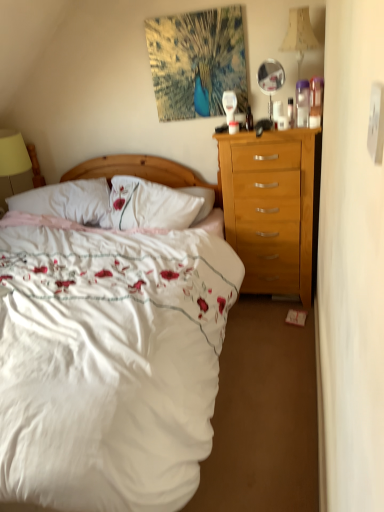
Describe the element at coordinates (112, 372) in the screenshot. I see `white satin bed at center` at that location.

Image resolution: width=384 pixels, height=512 pixels. What do you see at coordinates (233, 127) in the screenshot? I see `matte white coffee cup at center` at bounding box center [233, 127].

In order to face clear plastic bottle at upper right, marked as the first bottle in a right-to-left arrangement, should I rotate leftwards or rightwards?

Rotate your view right by about 13.258°.

Describe the element at coordinates (143, 170) in the screenshot. I see `wooden headboard at center` at that location.

Where is `white soft pillow at center`? Image resolution: width=384 pixels, height=512 pixels. white soft pillow at center is located at coordinates (68, 201).

Is beige fabric lampshade at upper right, which is counted as the second lamp, starting from the left, outside of yellow fabric lampshade at left, which is counted as the 1th lamp, starting from the back?

Yes, beige fabric lampshade at upper right, which is counted as the second lamp, starting from the left, is located beyond the bounds of yellow fabric lampshade at left, which is counted as the 1th lamp, starting from the back.

Consider the image. Does beige fabric lampshade at upper right, acting as the second lamp starting from the bottom, turn towards yellow fabric lampshade at left, which is the second lamp from right to left?

No, beige fabric lampshade at upper right, acting as the second lamp starting from the bottom, does not turn towards yellow fabric lampshade at left, which is the second lamp from right to left.

Would you say beige fabric lampshade at upper right, which ranks as the second lamp in back-to-front order, is to the left or to the right of yellow fabric lampshade at left, marked as the second lamp in a front-to-back arrangement, in the picture?

From the image, it's evident that beige fabric lampshade at upper right, which ranks as the second lamp in back-to-front order, is to the right of yellow fabric lampshade at left, marked as the second lamp in a front-to-back arrangement.

Is beige fabric lampshade at upper right, acting as the first lamp starting from the right, not close to yellow fabric lampshade at left, which is the second lamp from right to left?

Absolutely, beige fabric lampshade at upper right, acting as the first lamp starting from the right, is distant from yellow fabric lampshade at left, which is the second lamp from right to left.

Is beige fabric lampshade at upper right, which is counted as the second lamp, starting from the left, at the back of clear glass mirror at upper right?

That's not correct — clear glass mirror at upper right is not looking away from beige fabric lampshade at upper right, which is counted as the second lamp, starting from the left.

From the image's perspective, is clear glass mirror at upper right located above or below beige fabric lampshade at upper right, which is counted as the second lamp, starting from the left?

Clearly, from the image's perspective, clear glass mirror at upper right is below beige fabric lampshade at upper right, which is counted as the second lamp, starting from the left.

Between clear glass mirror at upper right and beige fabric lampshade at upper right, which is counted as the second lamp, starting from the left, which one is positioned in front?

beige fabric lampshade at upper right, which is counted as the second lamp, starting from the left, is more forward.

Are clear glass mirror at upper right and beige fabric lampshade at upper right, acting as the second lamp starting from the bottom, making contact?

No, clear glass mirror at upper right is not in contact with beige fabric lampshade at upper right, acting as the second lamp starting from the bottom.

Where is `bed that is in front of the clear glass mirror at upper right`? bed that is in front of the clear glass mirror at upper right is located at coordinates (112, 372).

Is clear glass mirror at upper right thinner than white satin bed at center?

Correct, the width of clear glass mirror at upper right is less than that of white satin bed at center.

Between clear glass mirror at upper right and white satin bed at center, which one has larger size?

white satin bed at center.

Is point (73, 205) in front of point (68, 475)?

No, it is not.

Looking at this image, is white soft pillow at center touching white satin bed at center?

No, white soft pillow at center is not with white satin bed at center.

Is white soft pillow at center looking in the opposite direction of translucent plastic bottle at upper center, positioned as the 1th bottle in left-to-right order?

white soft pillow at center does not have its back to translucent plastic bottle at upper center, positioned as the 1th bottle in left-to-right order.

From the picture: From a real-world perspective, is white soft pillow at center over translucent plastic bottle at upper center, which appears as the first bottle when viewed from the top?

Incorrect, from a real-world perspective, white soft pillow at center is lower than translucent plastic bottle at upper center, which appears as the first bottle when viewed from the top.

From the image's perspective, which is below, white soft pillow at center or translucent plastic bottle at upper center, positioned as the 1th bottle in left-to-right order?

white soft pillow at center is shown below in the image.

At what (x,y) coordinates should I click in order to perform the action: click on pillow that appears below the translucent plastic bottle at upper center, arranged as the second bottle when viewed from the right (from the image's perspective). Please return your answer as a coordinate pair (x, y). Image resolution: width=384 pixels, height=512 pixels. Looking at the image, I should click on point(68,201).

Can you confirm if white satin bed at center is thinner than white soft pillow at center?

No.

Who is bigger, white satin bed at center or white soft pillow at center?

white satin bed at center is bigger.

Would you say white satin bed at center is outside white soft pillow at center?

white satin bed at center is positioned outside white soft pillow at center.

Do you think yellow fabric lampshade at left, which is the second lamp from right to left, is within wooden headboard at center, or outside of it?

yellow fabric lampshade at left, which is the second lamp from right to left, is located beyond the bounds of wooden headboard at center.

Could you measure the distance between yellow fabric lampshade at left, which is counted as the 1th lamp, starting from the back, and wooden headboard at center?

A distance of 23.43 inches exists between yellow fabric lampshade at left, which is counted as the 1th lamp, starting from the back, and wooden headboard at center.

Considering the positions of point (18, 143) and point (69, 173), is point (18, 143) closer or farther from the camera than point (69, 173)?

Clearly, point (18, 143) is closer to the camera than point (69, 173).

Does yellow fabric lampshade at left, the 1th lamp in the bottom-to-top sequence, appear on the right side of wooden headboard at center?

No.

The height and width of the screenshot is (512, 384). Identify the location of lamp in front of the yellow fabric lampshade at left, which is the first lamp in left-to-right order. (299, 35).

Identify the location of lamp above the clear glass mirror at upper right (from the image's perspective). Image resolution: width=384 pixels, height=512 pixels. (299, 35).

Considering their positions, is white soft pillow at center positioned further to wooden headboard at center than yellow fabric lampshade at left, placed as the second lamp when sorted from top to bottom?

yellow fabric lampshade at left, placed as the second lamp when sorted from top to bottom, is further to wooden headboard at center.

Considering their positions, is clear plastic bottle at upper right, the first bottle ordered from the bottom, positioned closer to matte white coffee cup at center than yellow fabric lampshade at left, which is counted as the 1th lamp, starting from the back?

clear plastic bottle at upper right, the first bottle ordered from the bottom, lies closer to matte white coffee cup at center than the other object.

Which object lies further to the anchor point white soft pillow at center, yellow fabric lampshade at left, marked as the second lamp in a front-to-back arrangement, or translucent plastic bottle at upper center, positioned as the 1th bottle in left-to-right order?

translucent plastic bottle at upper center, positioned as the 1th bottle in left-to-right order, is positioned further to the anchor white soft pillow at center.

Consider the image. Based on their spatial positions, is clear glass mirror at upper right or matte white coffee cup at center further from clear plastic bottle at upper right, which is the 2th bottle in back-to-front order?

The object further to clear plastic bottle at upper right, which is the 2th bottle in back-to-front order, is matte white coffee cup at center.

Considering their positions, is clear plastic bottle at upper right, the first bottle ordered from the bottom, positioned closer to yellow fabric lampshade at left, which is the first lamp in left-to-right order, than wooden headboard at center?

Based on the image, wooden headboard at center appears to be nearer to yellow fabric lampshade at left, which is the first lamp in left-to-right order.

Based on their spatial positions, is clear plastic bottle at upper right, the second bottle from the left, or clear glass mirror at upper right closer to yellow fabric lampshade at left, marked as the second lamp in a front-to-back arrangement?

clear glass mirror at upper right is positioned closer to the anchor yellow fabric lampshade at left, marked as the second lamp in a front-to-back arrangement.

Estimate the real-world distances between objects in this image. Which object is further from beige fabric lampshade at upper right, acting as the second lamp starting from the bottom, wooden headboard at center or white soft pillow at center?

white soft pillow at center lies further to beige fabric lampshade at upper right, acting as the second lamp starting from the bottom, than the other object.

Based on their spatial positions, is clear plastic bottle at upper right, the second bottle from the left, or clear glass mirror at upper right closer to white soft pillow at center?

clear glass mirror at upper right is closer to white soft pillow at center.

Locate an element on the screen. The height and width of the screenshot is (512, 384). bottle located between matte white coffee cup at center and beige fabric lampshade at upper right, which is counted as the second lamp, starting from the left, in the left-right direction is located at coordinates (290, 112).

Locate an element on the screen. coffee cup between translucent plastic bottle at upper center, the 2th bottle in the bottom-to-top sequence, and clear glass mirror at upper right from left to right is located at coordinates (233, 127).

Where is `pillow between yellow fabric lampshade at left, which is the first lamp in left-to-right order, and clear glass mirror at upper right`? pillow between yellow fabric lampshade at left, which is the first lamp in left-to-right order, and clear glass mirror at upper right is located at coordinates (68, 201).

At what (x,y) coordinates should I click in order to perform the action: click on bottle between white soft pillow at center and clear plastic bottle at upper right, marked as the first bottle in a right-to-left arrangement, from left to right. Please return your answer as a coordinate pair (x, y). The width and height of the screenshot is (384, 512). Looking at the image, I should click on (229, 105).